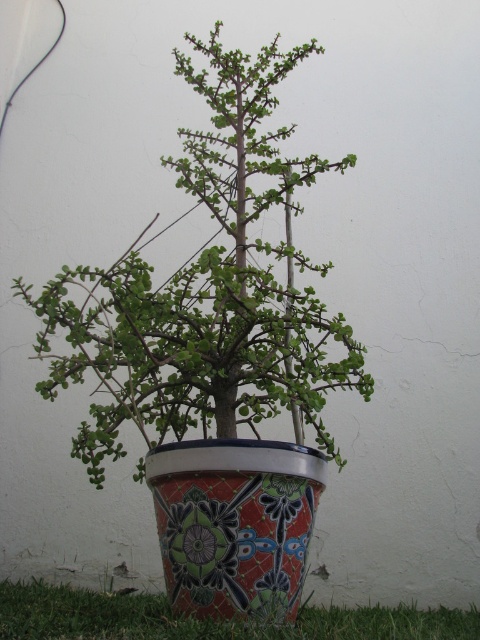
Who is positioned more to the left, green glossy plant at center or matte ceramic pot at center?

From the viewer's perspective, green glossy plant at center appears more on the left side.

Can you confirm if green glossy plant at center is positioned to the left of matte ceramic pot at center?

Yes, green glossy plant at center is to the left of matte ceramic pot at center.

Where is `green glossy plant at center`? The image size is (480, 640). green glossy plant at center is located at coordinates (207, 289).

Find the location of a particular element. The width and height of the screenshot is (480, 640). green glossy plant at center is located at coordinates (207, 289).